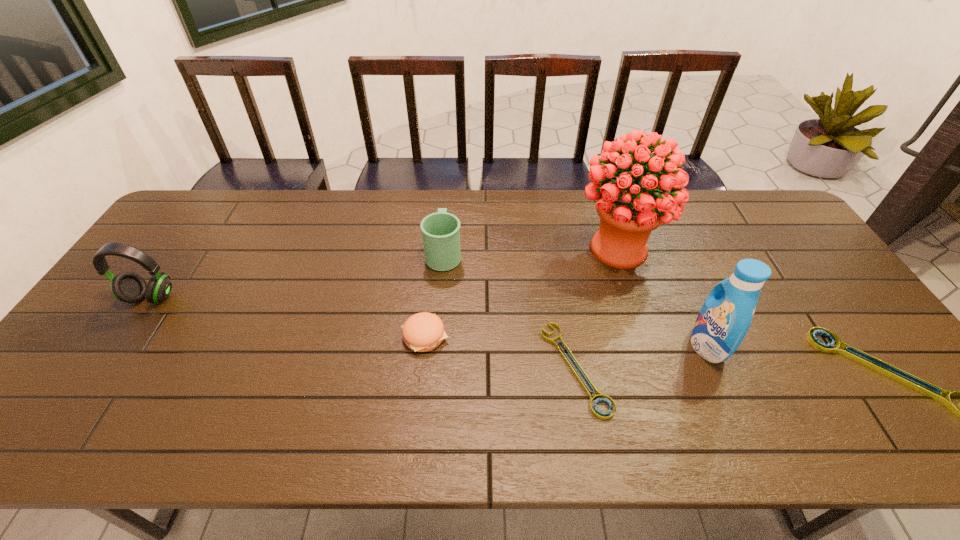
Given the evenly spaced wrenchs in the image, where should an extra wrench be added on the left to preserve the spacing? Please point to a vacant space. Please provide its 2D coordinates. Your answer should be formatted as a tuple, i.e. [(x, y)], where the tuple contains the x and y coordinates of a point satisfying the conditions above.

[(268, 364)]